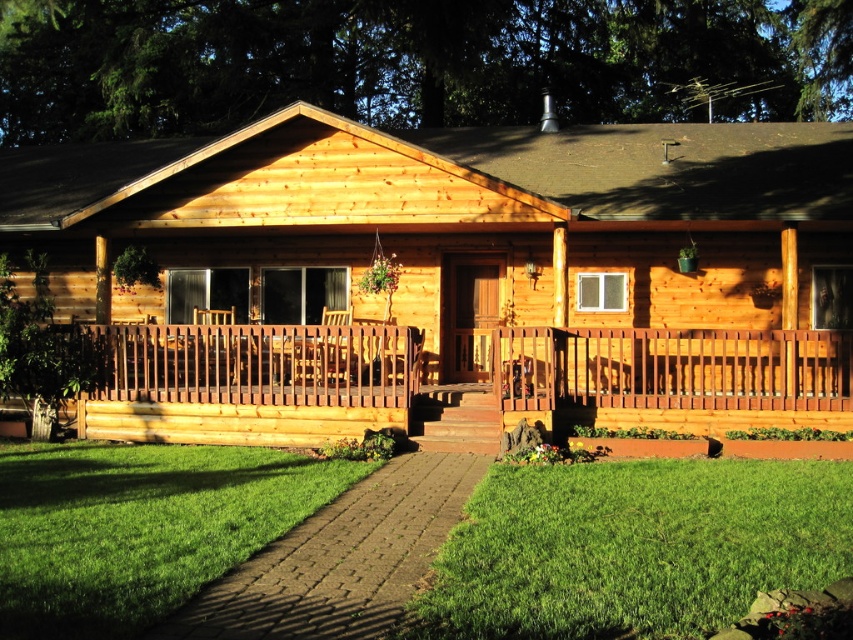
Does natural wood cabin at center appear on the left side of green grass at lower left?

No, natural wood cabin at center is not to the left of green grass at lower left.

Is natural wood cabin at center above green grass at lower left?

Yes.

At what (x,y) coordinates should I click in order to perform the action: click on natural wood cabin at center. Please return your answer as a coordinate pair (x, y). Looking at the image, I should click on (451, 216).

Describe the element at coordinates (631, 547) in the screenshot. This screenshot has height=640, width=853. I see `green grass at lower center` at that location.

Between point (546, 595) and point (42, 550), which one is positioned behind?

Positioned behind is point (42, 550).

Locate an element on the screen. Image resolution: width=853 pixels, height=640 pixels. green grass at lower center is located at coordinates (631, 547).

Is natural wood cabin at center bigger than natural wood porch at center?

Yes, natural wood cabin at center is bigger than natural wood porch at center.

Does natural wood cabin at center have a smaller size compared to natural wood porch at center?

Incorrect, natural wood cabin at center is not smaller in size than natural wood porch at center.

Image resolution: width=853 pixels, height=640 pixels. Find the location of `natural wood cabin at center`. natural wood cabin at center is located at coordinates (451, 216).

You are a GUI agent. You are given a task and a screenshot of the screen. Output one action in this format:
    pyautogui.click(x=<x>, y=<y>)
    Task: Click on the natural wood cabin at center
    This screenshot has height=640, width=853.
    Given the screenshot: What is the action you would take?
    pyautogui.click(x=451, y=216)